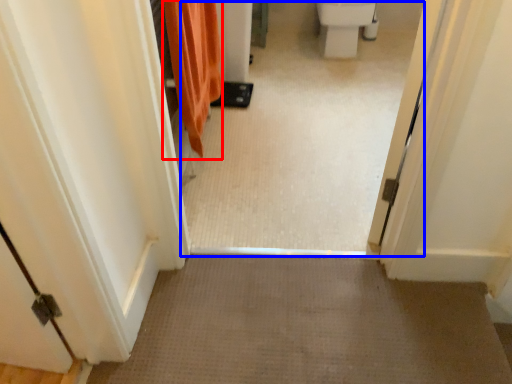
Question: Among these objects, which one is nearest to the camera, shower curtain (highlighted by a red box) or passage (highlighted by a blue box)?

Choices:
 (A) shower curtain
 (B) passage

Answer: (B)